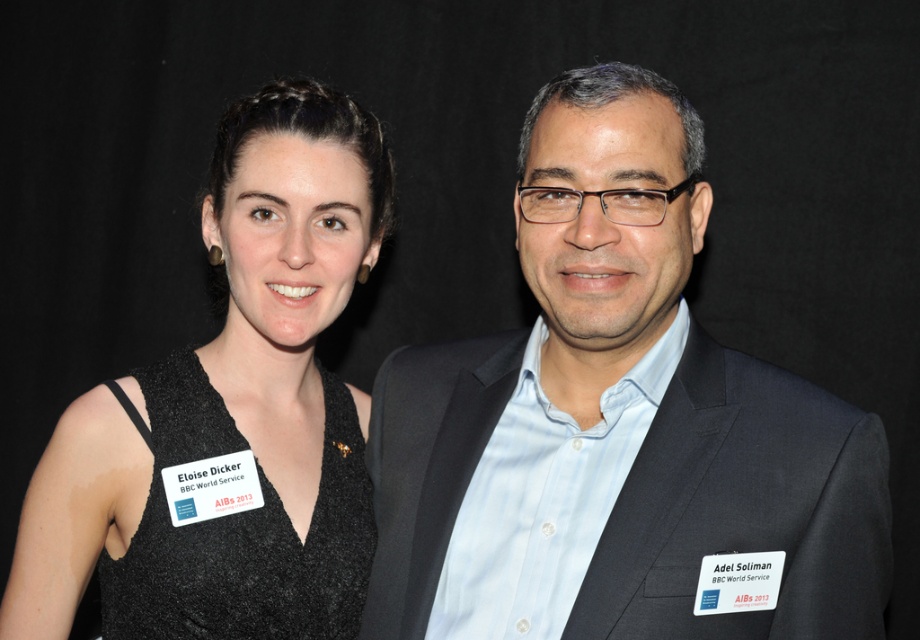
You are a fashion designer analyzing the two outfits in the image. Which of the two items, the matte black suit at center or the black textured dress at left, appears shorter in the photo?

The matte black suit at center appears shorter than the black textured dress at left in the photo.

You are a photographer setting up a shoot with two models wearing the matte black suit at center and the black textured dress at left. The background is plain black. Which model should stand where to ensure their outfit details are most visible against the background?

The model wearing the black textured dress at left should stand where the details of the texture can contrast against the plain black background, while the matte black suit at center might blend in more due to its lack of texture. Position the textured dress model closer to the background to highlight its details, and place the matte suit model slightly forward to avoid blending into the background.

In the scene shown: You are a photographer setting up for a photo shoot. You need to ensure that the matte black suit at center and the black textured dress at left are both visible in the frame. Given that the background is plain black, which object might be harder to see and why?

The matte black suit at center might be harder to see because it is positioned under the black textured dress at left, and since both are black, the lack of contrast between them against the plain black background could make the matte black suit less distinguishable.